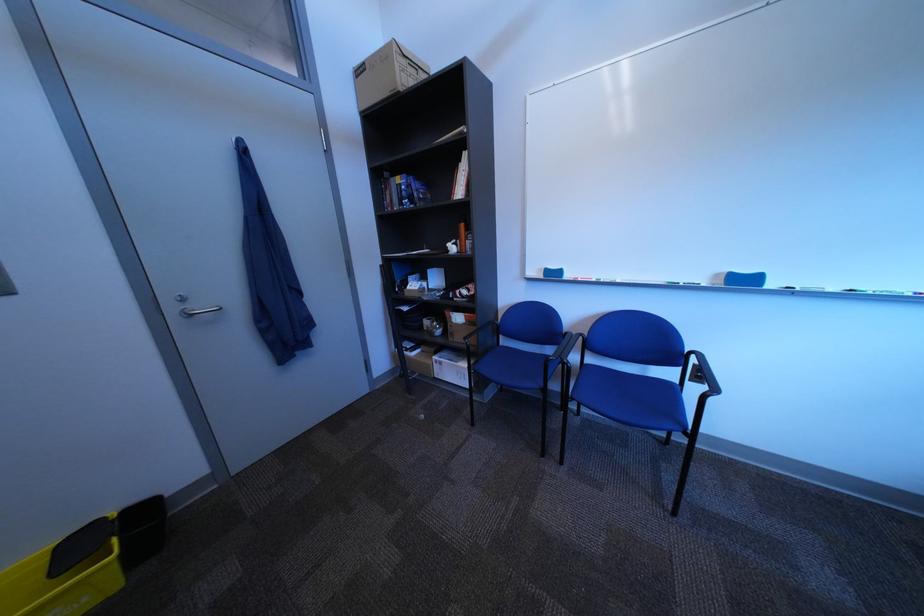
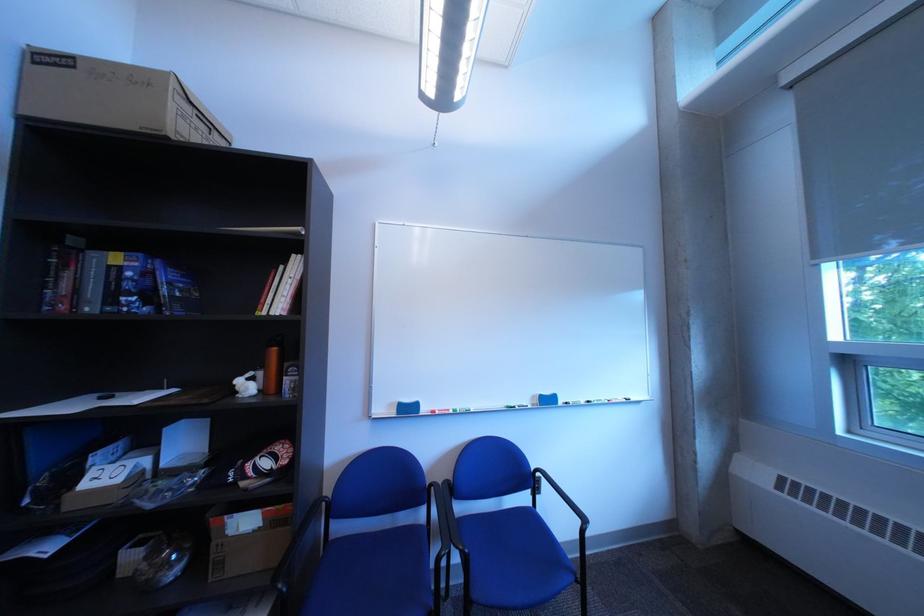
In the second image, find the point that corresponds to point 606,281 in the first image.

(465, 411)